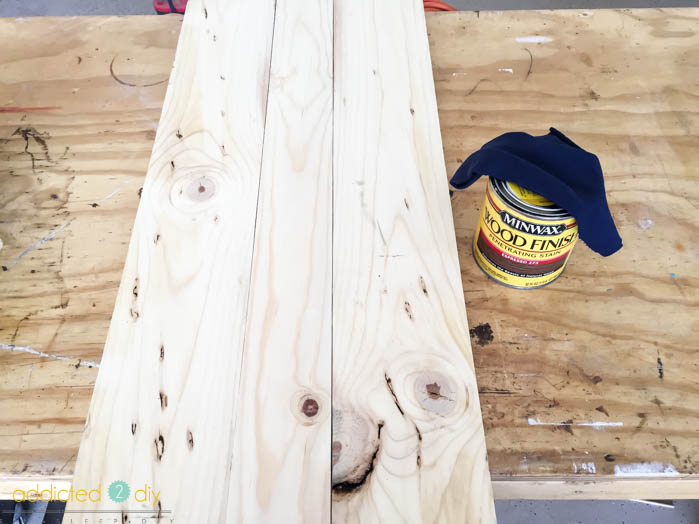
You are a GUI agent. You are given a task and a screenshot of the screen. Output one action in this format:
    pyautogui.click(x=<x>, y=<y>)
    Task: Click on the towel
    
    Given the screenshot: What is the action you would take?
    pyautogui.click(x=542, y=174)